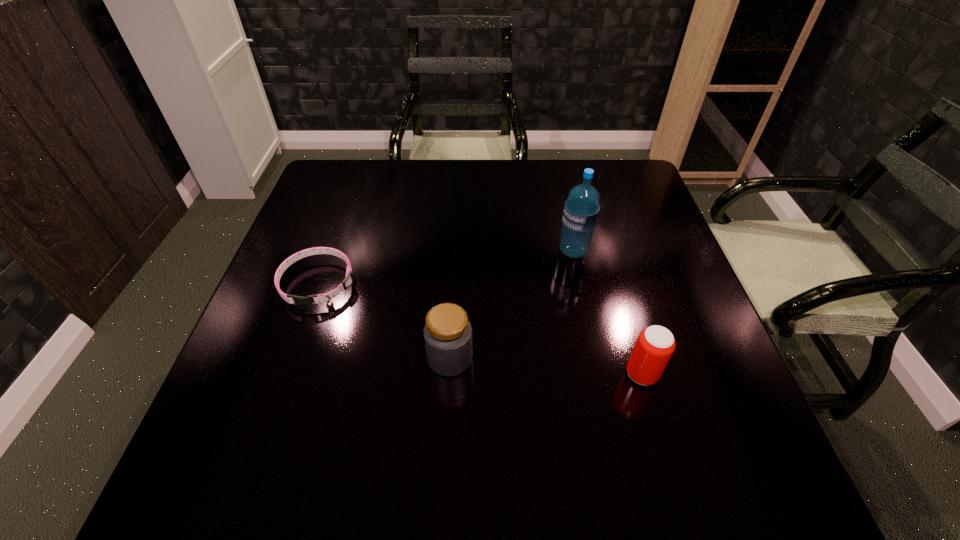
Select which object appears as the closest to the second object from left to right. Please provide its 2D coordinates. Your answer should be formatted as a tuple, i.e. [(x, y)], where the tuple contains the x and y coordinates of a point satisfying the conditions above.

[(346, 283)]

At what (x,y) coordinates should I click in order to perform the action: click on object that stands as the second closest to the beer can. Please return your answer as a coordinate pair (x, y). Looking at the image, I should click on (448, 334).

The height and width of the screenshot is (540, 960). What are the coordinates of `free space in the image that satisfies the following two spatial constraints: 1. on the front side of the rightmost object; 2. on the left side of the tallest object` in the screenshot? It's located at (600, 374).

You are a GUI agent. You are given a task and a screenshot of the screen. Output one action in this format:
    pyautogui.click(x=<x>, y=<y>)
    Task: Click on the vacant space that satisfies the following two spatial constraints: 1. with the buckle on the leftmost object; 2. on the left side of the rightmost object
    The height and width of the screenshot is (540, 960).
    Given the screenshot: What is the action you would take?
    pyautogui.click(x=287, y=374)

You are a GUI agent. You are given a task and a screenshot of the screen. Output one action in this format:
    pyautogui.click(x=<x>, y=<y>)
    Task: Click on the free point that satisfies the following two spatial constraints: 1. with the buckle on the rightmost object; 2. on the left side of the shortest object
    The image size is (960, 540).
    Given the screenshot: What is the action you would take?
    pyautogui.click(x=287, y=374)

Image resolution: width=960 pixels, height=540 pixels. I want to click on vacant space that satisfies the following two spatial constraints: 1. with the buckle on the leftmost object; 2. on the left side of the beer can, so coord(287,374).

Identify the location of vacant position in the image that satisfies the following two spatial constraints: 1. on the surface of the jar near the warning symbol; 2. on the back side of the beer can. (449, 374).